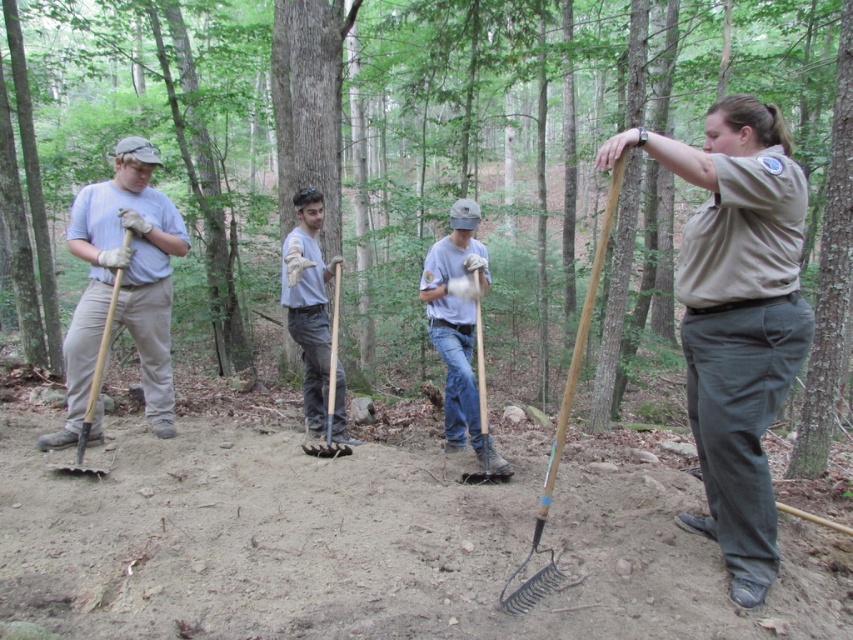
Question: Is brown wood tree at center bigger than matte gray shirt at center?

Choices:
 (A) yes
 (B) no

Answer: (A)

Question: Does matte gray shirt at left appear on the left side of brushed metal shovel at left?

Choices:
 (A) no
 (B) yes

Answer: (A)

Question: Which object is farther from the camera taking this photo?

Choices:
 (A) brown rough bark tree at right
 (B) wooden shovel at center

Answer: (B)

Question: Which point is farther to the camera?

Choices:
 (A) (335, 324)
 (B) (801, 410)
 (C) (451, 289)
 (D) (511, 600)

Answer: (B)

Question: Which object is the closest to the brown rough bark tree at right?

Choices:
 (A) matte gray shirt at left
 (B) wooden rake at right
 (C) brushed metal shovel at center

Answer: (C)

Question: Is wooden rake at right positioned before brushed metal shovel at center?

Choices:
 (A) yes
 (B) no

Answer: (A)